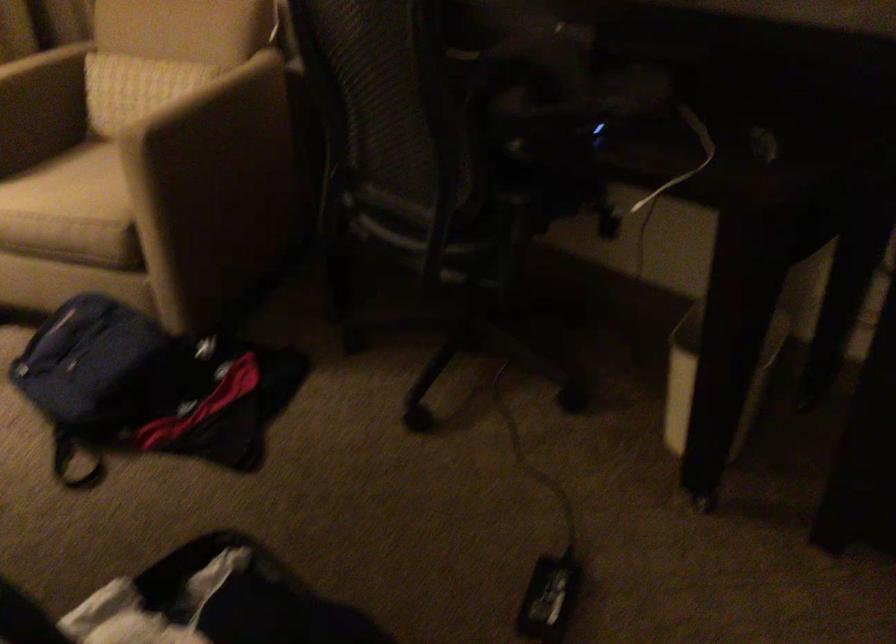
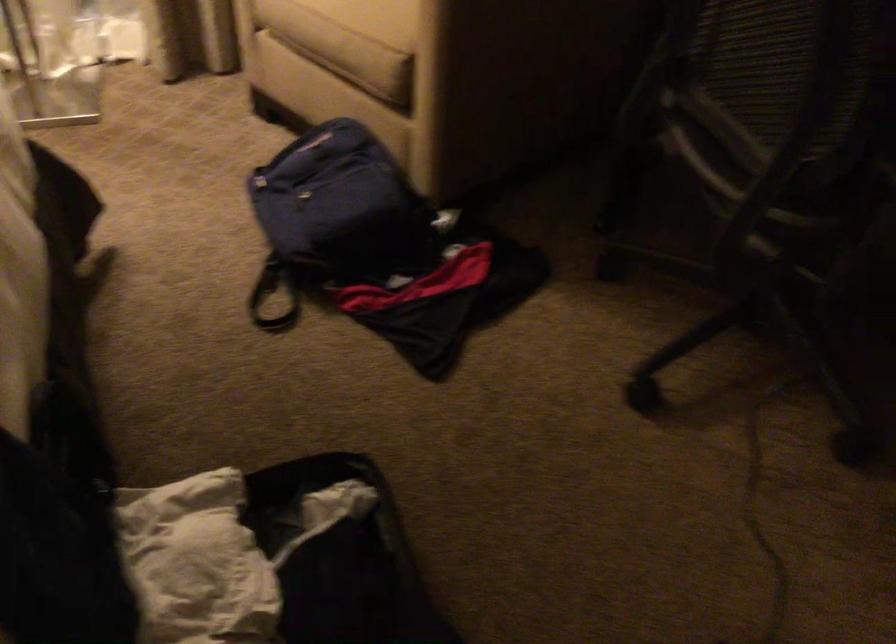
Locate, in the second image, the point that corresponds to (419,232) in the first image.

(736, 167)